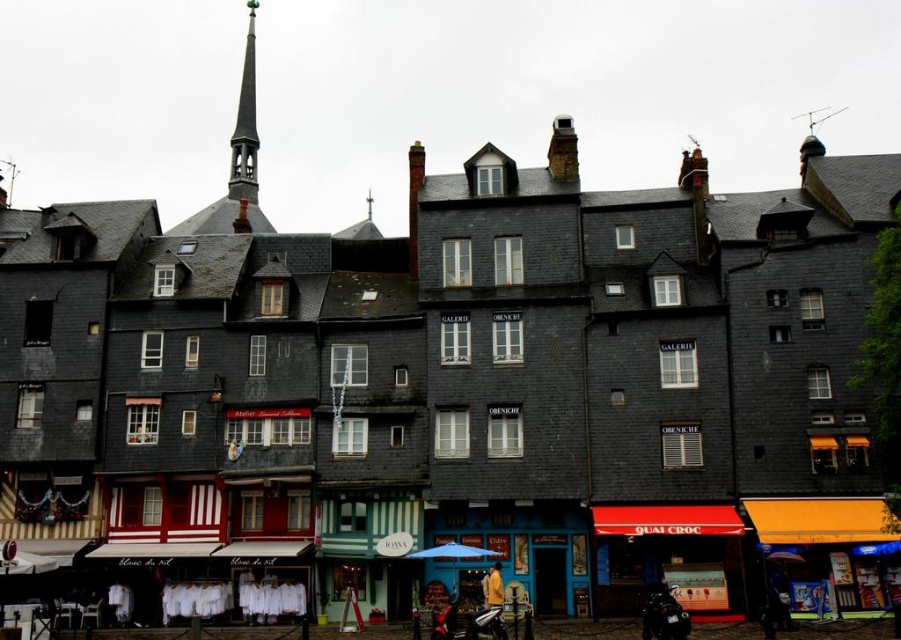
You are a tourist standing in front of the blue painted wooden shop at center and the orange fabric awning at lower right. Which object is taller?

The blue painted wooden shop at center is taller than the orange fabric awning at lower right.

You are a customer standing in front of the blue painted wooden shop at center and the orange fabric awning at lower right. Which one takes up more area in the scene?

The orange fabric awning at lower right takes up more area in the scene than the blue painted wooden shop at center because the blue painted wooden shop at center occupies less space than orange fabric awning at lower right.

You are a tourist standing in front of the row of buildings. You notice the red awning at lower right and the smooth gray spire at upper left. Which of these two objects appears smaller in the image?

The red awning at lower right appears smaller compared to the smooth gray spire at upper left as stated in the object description.